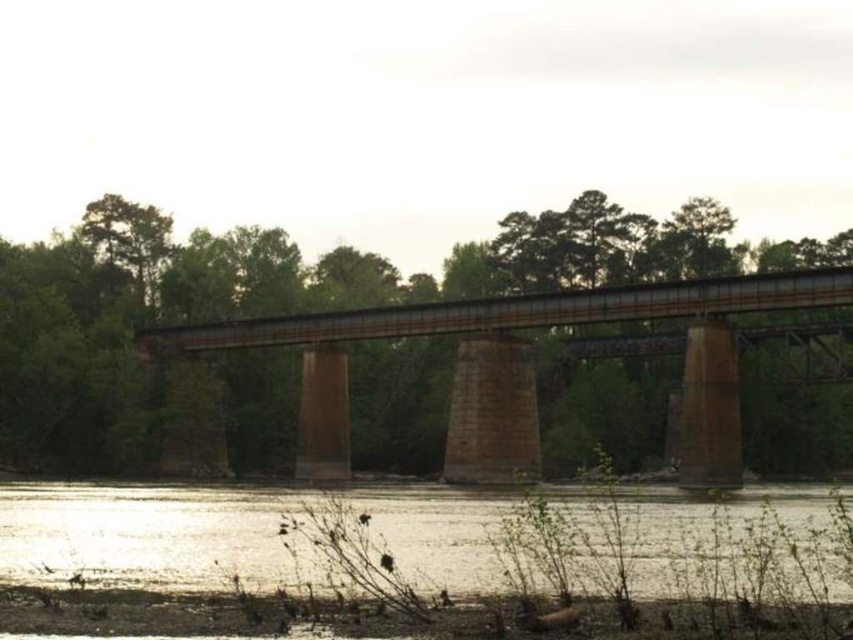
You are a photographer planning to capture the rusty metal bridge at center and the silvery reflective water at lower center in a single frame. Based on their relative heights, which object will appear larger in the photo?

The rusty metal bridge at center will appear larger in the photo because it is taller than the silvery reflective water at lower center.